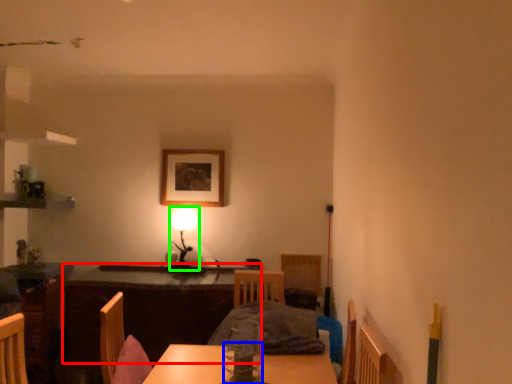
Question: Considering the real-world distances, which object is farthest from table (highlighted by a red box)? tableware (highlighted by a blue box) or table lamp (highlighted by a green box)?

Choices:
 (A) tableware
 (B) table lamp

Answer: (A)